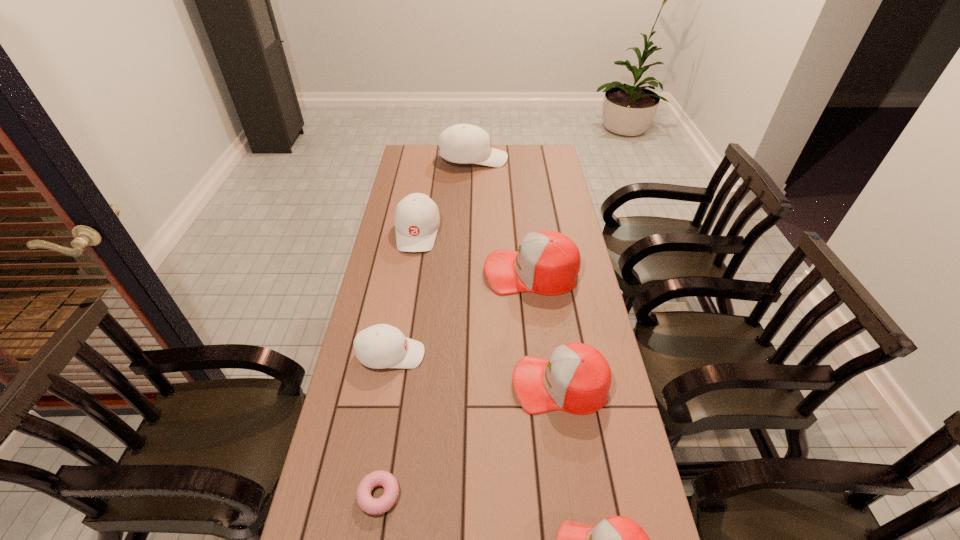
The width and height of the screenshot is (960, 540). What are the coordinates of `vacant region located 0.120m on the front-facing side of the farthest red baseball cap` in the screenshot? It's located at (450, 272).

The height and width of the screenshot is (540, 960). What are the coordinates of `free point located on the front-facing side of the farthest red baseball cap` in the screenshot? It's located at (442, 272).

Locate an element on the screen. The height and width of the screenshot is (540, 960). free space located on the front-facing side of the second farthest white baseball cap is located at coordinates (404, 315).

This screenshot has width=960, height=540. Find the location of `vacant space located on the front-facing side of the second smallest red baseball cap`. vacant space located on the front-facing side of the second smallest red baseball cap is located at coordinates (444, 384).

Identify the location of free spot located on the front-facing side of the second smallest red baseball cap. (415, 384).

Locate an element on the screen. vacant space located 0.060m on the front-facing side of the second smallest red baseball cap is located at coordinates (491, 384).

This screenshot has width=960, height=540. I want to click on free spot located 0.240m on the front-facing side of the smallest white baseball cap, so click(x=506, y=355).

Where is `free space located on the right of the sixth farthest object`? This screenshot has width=960, height=540. free space located on the right of the sixth farthest object is located at coordinates (439, 495).

Locate an element on the screen. This screenshot has width=960, height=540. object positioned at the far edge is located at coordinates (463, 143).

This screenshot has width=960, height=540. I want to click on doughnut at the left edge, so click(x=368, y=504).